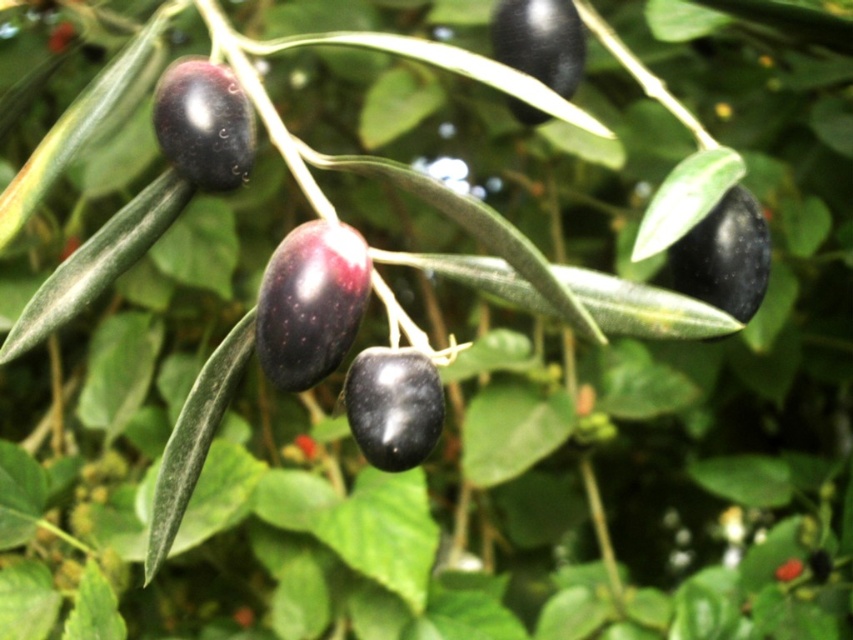
You are an olive picker and need to harvest the shiny dark olive at center and the shiny black olive at upper center. Which olive is positioned to the left of the other?

The shiny dark olive at center is to the left of shiny black olive at upper center.

You are a botanist examining an olive branch. You notice a shiny black olive at center. Can you determine its exact 2D coordinates in the image?

The shiny black olive at center is located at the 2D coordinates point (x=393, y=404).

You are an olive farmer inspecting a branch and notice a point marked at coordinates (204, 124). Based on the scene description, which object is this point located on?

The point at (204, 124) is located on the shiny dark olive at upper left.